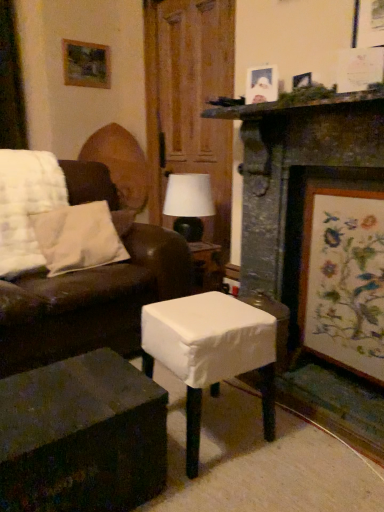
Image resolution: width=384 pixels, height=512 pixels. What are the coordinates of `vacant area that lies to the right of white fabric-covered stool at center, which ranks as the first table in right-to-left order` in the screenshot? It's located at click(305, 446).